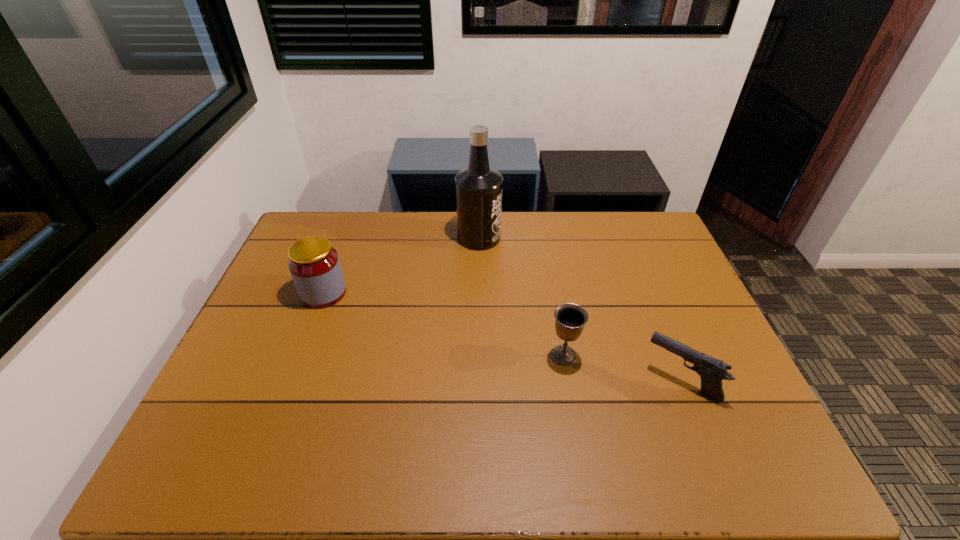
The image size is (960, 540). Identify the location of free area in between the third nearest object and the third object from left to right. (444, 324).

Where is `free space between the second object from right to left and the gun`? free space between the second object from right to left and the gun is located at coordinates (622, 368).

Locate an element on the screen. This screenshot has height=540, width=960. free spot between the gun and the second farthest object is located at coordinates (502, 337).

Identify which object is the nearest to the second farthest object. Please provide its 2D coordinates. Your answer should be formatted as a tuple, i.e. [(x, y)], where the tuple contains the x and y coordinates of a point satisfying the conditions above.

[(478, 188)]

I want to click on object that stands as the closest to the second object from left to right, so click(314, 264).

You are a GUI agent. You are given a task and a screenshot of the screen. Output one action in this format:
    pyautogui.click(x=<x>, y=<y>)
    Task: Click on the vacant space that satisfies the following two spatial constraints: 1. on the front label of the liquor; 2. on the left side of the second object from right to left
    
    Given the screenshot: What is the action you would take?
    pyautogui.click(x=479, y=355)

You are a GUI agent. You are given a task and a screenshot of the screen. Output one action in this format:
    pyautogui.click(x=<x>, y=<y>)
    Task: Click on the free location that satisfies the following two spatial constraints: 1. on the front label of the second object from left to right; 2. on the back side of the chalice
    The height and width of the screenshot is (540, 960).
    Given the screenshot: What is the action you would take?
    pyautogui.click(x=479, y=355)

In order to click on vacant space that satisfies the following two spatial constraints: 1. on the front label of the tallest object; 2. on the front side of the leftmost object in this screenshot , I will do `click(479, 293)`.

Image resolution: width=960 pixels, height=540 pixels. I want to click on vacant region that satisfies the following two spatial constraints: 1. on the front label of the chalice; 2. on the left side of the tallest object, so click(479, 355).